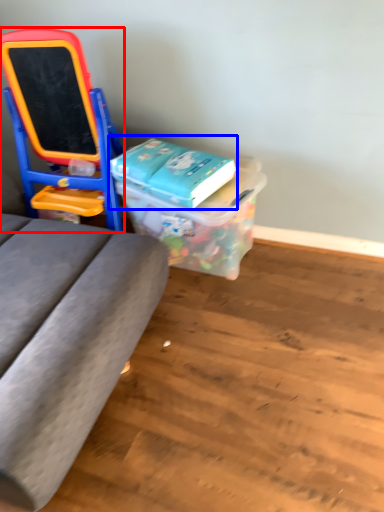
Question: Which of the following is the farthest to the observer, furniture (highlighted by a red box) or book (highlighted by a blue box)?

Choices:
 (A) furniture
 (B) book

Answer: (B)